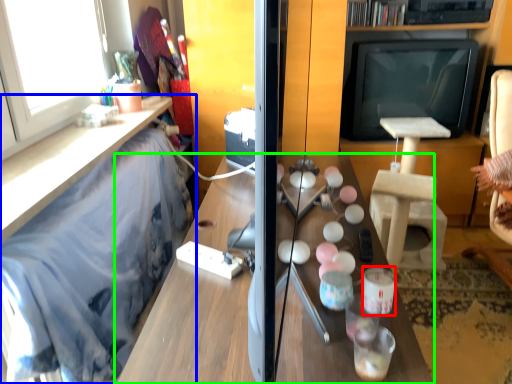
Question: Which is farther away from candle holder (highlighted by a red box)? furniture (highlighted by a blue box) or table (highlighted by a green box)?

Choices:
 (A) furniture
 (B) table

Answer: (A)